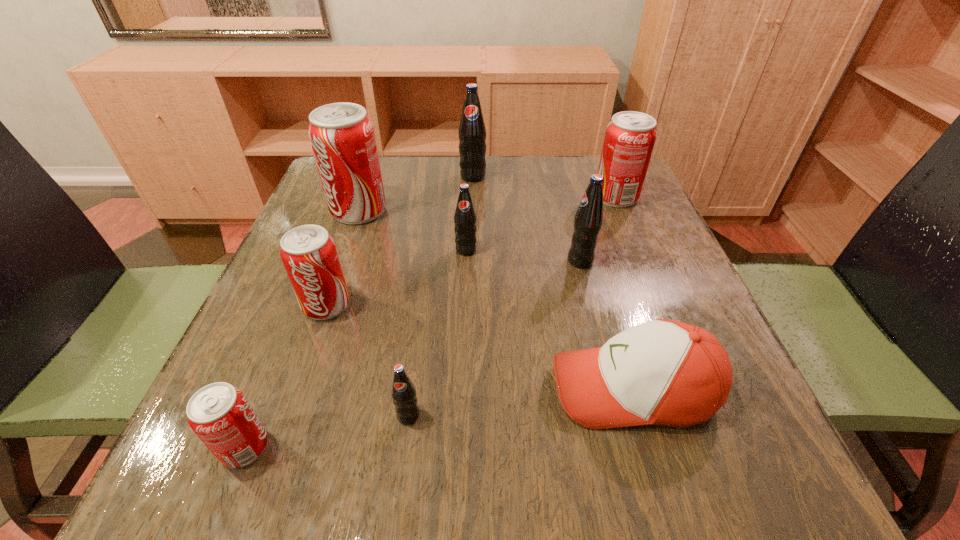
Identify the location of unoccupied position between the orange baseball cap and the nearest black pop. (520, 402).

Where is `vacant area that lies between the sixth farthest soda can and the orange baseball cap`? The image size is (960, 540). vacant area that lies between the sixth farthest soda can and the orange baseball cap is located at coordinates (480, 347).

Find the location of a particular element. The height and width of the screenshot is (540, 960). unoccupied position between the third biggest black pop and the sixth farthest soda can is located at coordinates (396, 278).

This screenshot has height=540, width=960. Find the location of `free area in between the third smallest red soda can and the biggest red soda can`. free area in between the third smallest red soda can and the biggest red soda can is located at coordinates (488, 204).

This screenshot has width=960, height=540. I want to click on vacant space in between the sixth farthest soda can and the farthest object, so click(x=399, y=241).

Find the location of a particular element. free space that is in between the seventh soda can from left to right and the third biggest black pop is located at coordinates (523, 255).

What are the coordinates of `vacant point located between the fifth soda can from right to left and the baseball cap` in the screenshot? It's located at (x=520, y=402).

Find the location of a particular element. This screenshot has width=960, height=540. object that stands as the closest to the farthest soda can is located at coordinates click(342, 137).

I want to click on object identified as the second closest to the sixth farthest soda can, so click(342, 137).

Choose which soda can is the second nearest neighbor to the biggest red soda can. Please provide its 2D coordinates. Your answer should be formatted as a tuple, i.e. [(x, y)], where the tuple contains the x and y coordinates of a point satisfying the conditions above.

[(465, 219)]